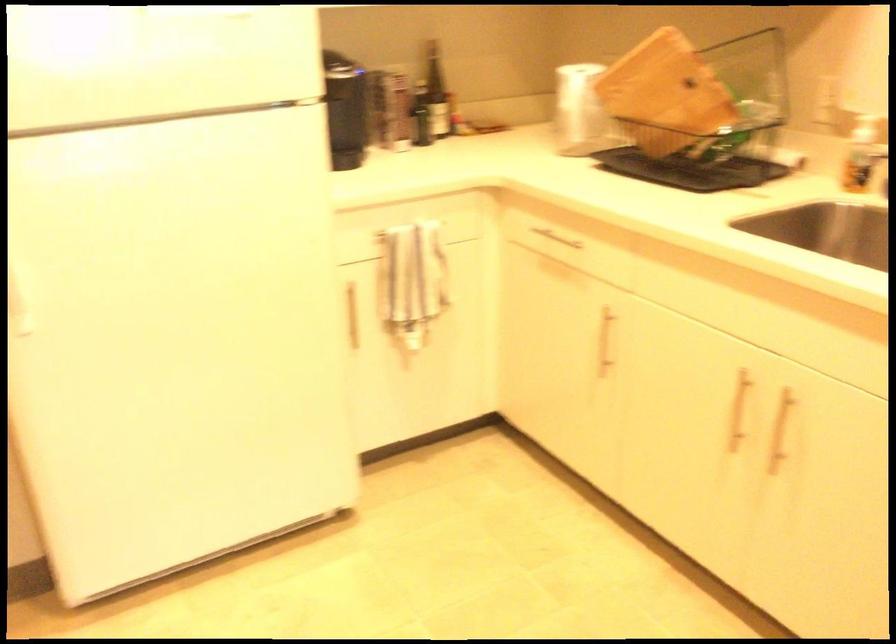
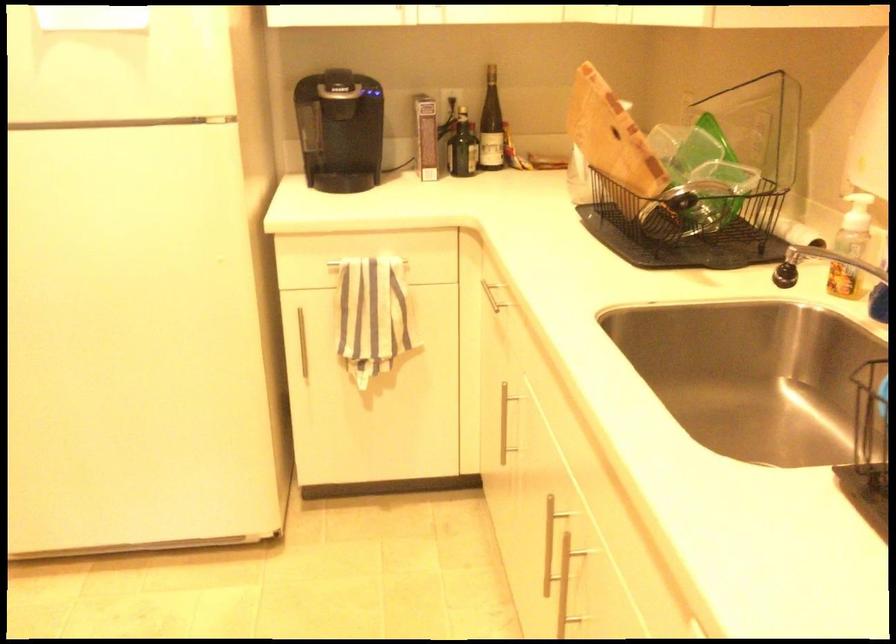
Question: The images are taken continuously from a first-person perspective. In which direction is your viewpoint rotating?

Choices:
 (A) Left
 (B) Right
 (C) Up
 (D) Down

Answer: (A)